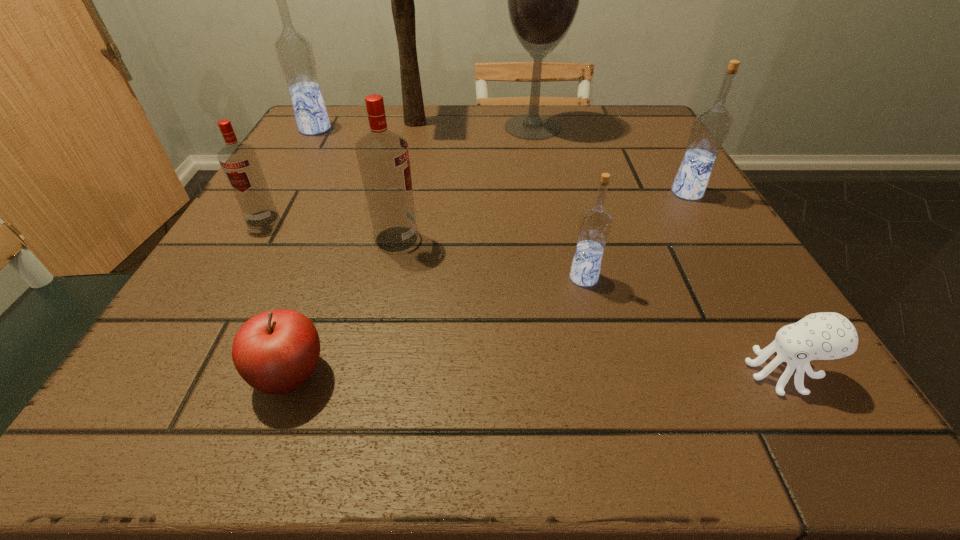
Find the location of a particular element. apple that is positioned at the left edge is located at coordinates click(x=275, y=352).

Where is `vodka that is at the right edge`? vodka that is at the right edge is located at coordinates (711, 126).

Identify the location of octopus present at the right edge. The width and height of the screenshot is (960, 540). (827, 335).

At what (x,y) coordinates should I click in order to perform the action: click on object at the far left corner. Please return your answer as a coordinate pair (x, y). Looking at the image, I should click on (294, 51).

This screenshot has height=540, width=960. What are the coordinates of `object that is at the near left corner` in the screenshot? It's located at (275, 352).

Find the location of `object located in the near right corner section of the desktop`. object located in the near right corner section of the desktop is located at coordinates (827, 335).

Where is `vacant space at the far edge of the desktop`? vacant space at the far edge of the desktop is located at coordinates (412, 136).

Locate an element on the screen. The width and height of the screenshot is (960, 540). vacant space at the near edge of the desktop is located at coordinates (369, 392).

Find the location of a particular element. blank space at the left edge is located at coordinates (218, 319).

At what (x,y) coordinates should I click in order to perform the action: click on free space at the right edge of the desktop. Please return your answer as a coordinate pair (x, y). Looking at the image, I should click on (668, 306).